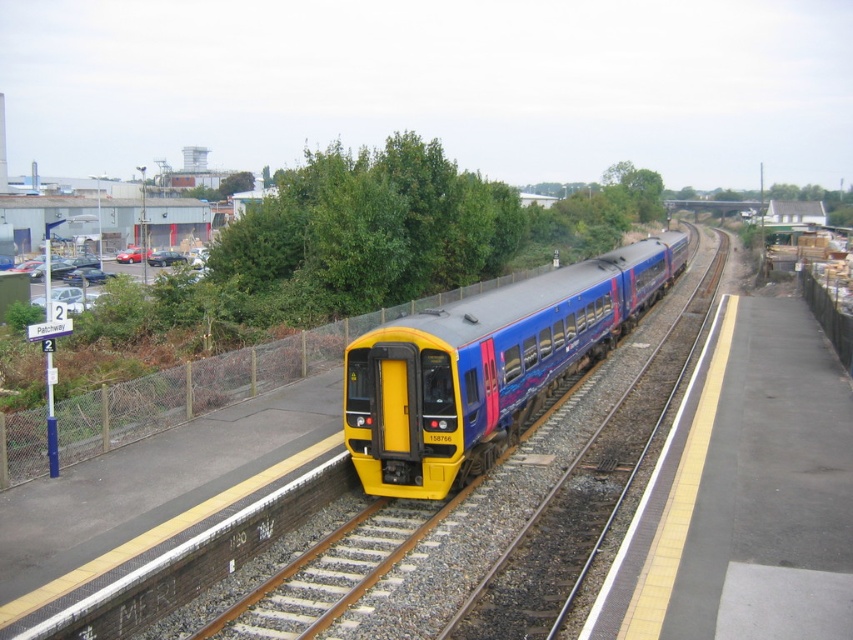
You are a passenger waiting on the platform at Patchway station. You notice the matte blue train at center and the green leafy tree at upper center. How far apart are these two objects?

The matte blue train at center is 74.73 meters from the green leafy tree at upper center.

You are a passenger waiting on the platform for the train. You notice a green leafy tree at upper center and a matte blue train at center. Which object is higher up in the image?

The green leafy tree at upper center is higher up in the image than the matte blue train at center.